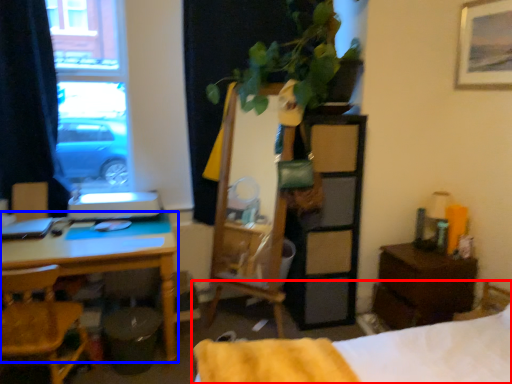
Question: Which point is closer to the camera, bed (highlighted by a red box) or desk (highlighted by a blue box)?

Choices:
 (A) bed
 (B) desk

Answer: (A)